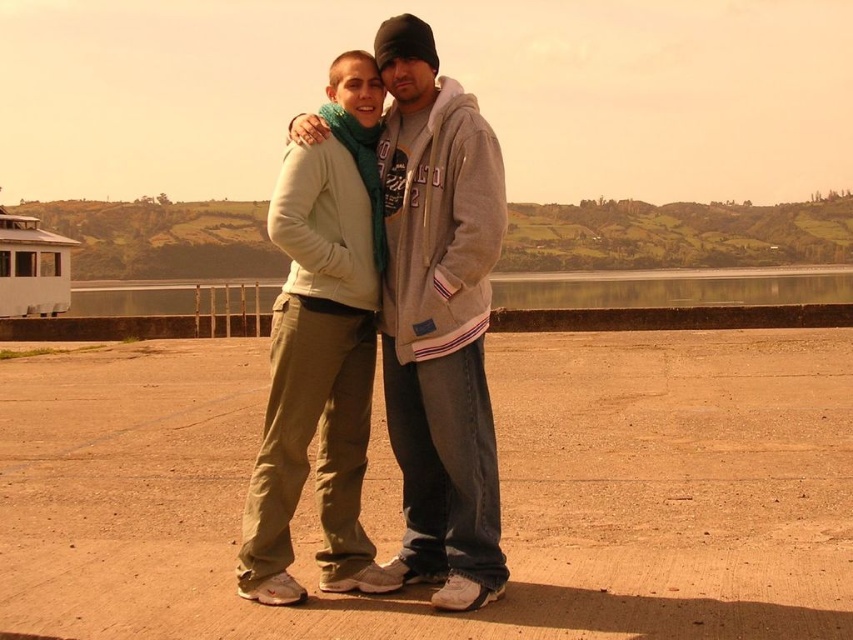
Which is in front, point (485, 579) or point (556, 296)?

Point (485, 579) is more forward.

Who is positioned more to the left, matte gray hoodie at center or transparent glass water at center?

matte gray hoodie at center is more to the left.

Between point (438, 152) and point (119, 308), which one is positioned in front?

Point (438, 152) is more forward.

The height and width of the screenshot is (640, 853). I want to click on matte gray hoodie at center, so click(x=439, y=320).